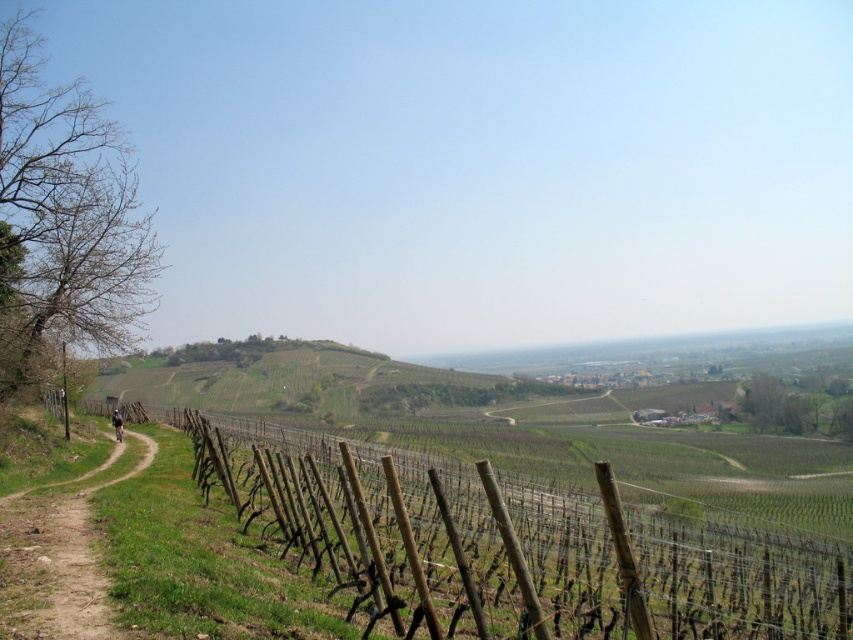
Question: Which point is farther to the camera?

Choices:
 (A) brown wooden fence at center
 (B) brown dirt path at left

Answer: (B)

Question: Does brown wooden fence at center have a greater width compared to brown dirt path at left?

Choices:
 (A) yes
 (B) no

Answer: (A)

Question: Is brown wooden fence at center to the left of brown dirt path at left from the viewer's perspective?

Choices:
 (A) yes
 (B) no

Answer: (B)

Question: Does brown wooden fence at center have a greater width compared to brown dirt path at left?

Choices:
 (A) yes
 (B) no

Answer: (A)